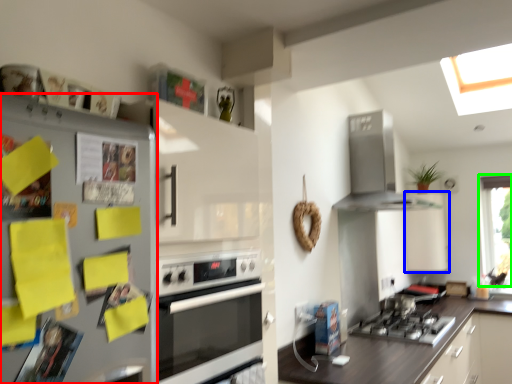
Question: Considering the real-world distances, which object is closest to refrigerator (highlighted by a red box)? cabinetry (highlighted by a blue box) or window (highlighted by a green box).

Choices:
 (A) cabinetry
 (B) window

Answer: (A)